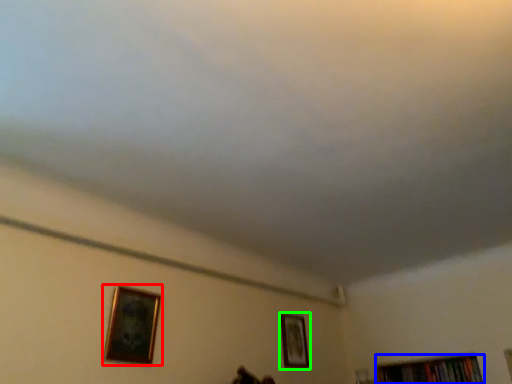
Question: Considering the real-world distances, which object is farthest from picture frame (highlighted by a red box)? book (highlighted by a blue box) or picture frame (highlighted by a green box)?

Choices:
 (A) book
 (B) picture frame

Answer: (A)